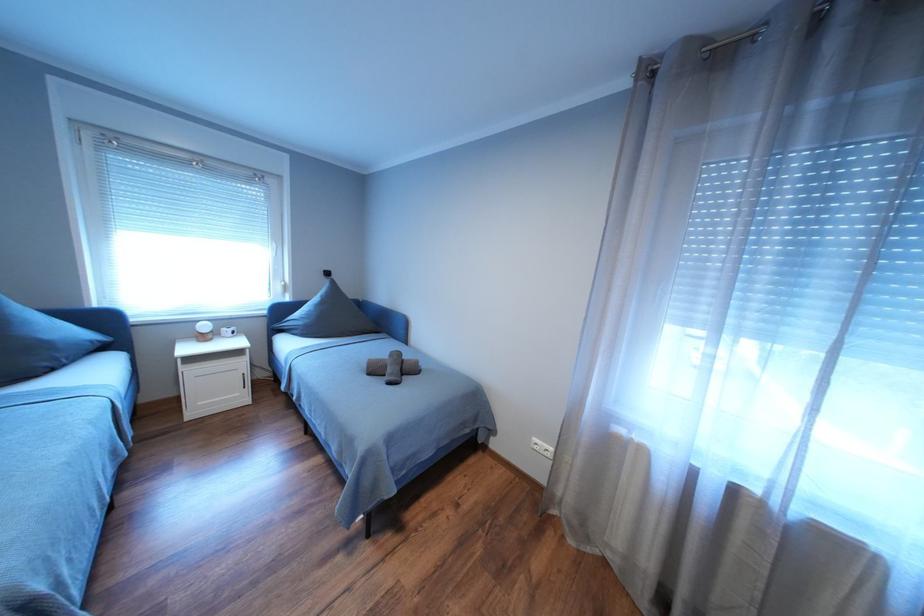
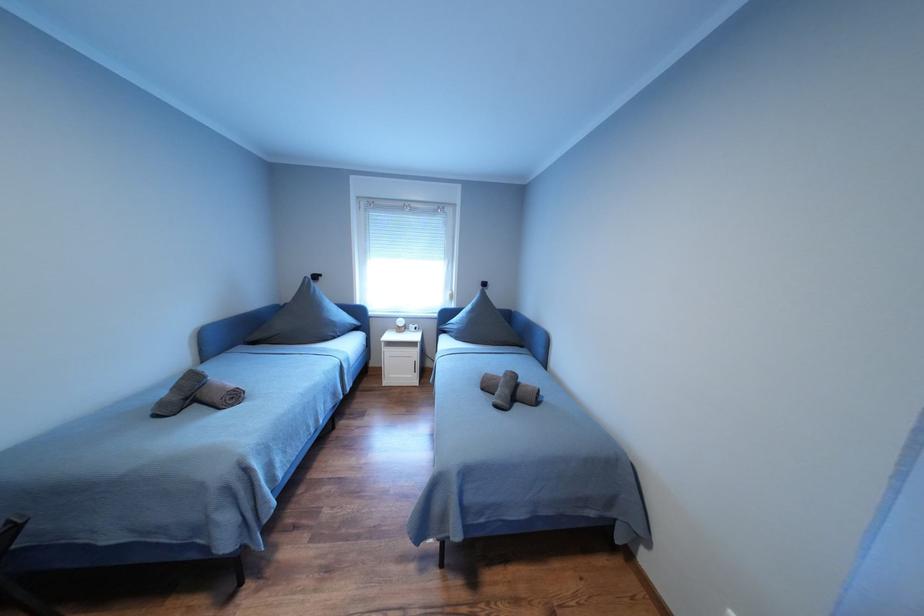
Question: The first image is from the beginning of the video and the second image is from the end. How did the camera likely rotate when shooting the video?

Choices:
 (A) Left
 (B) Right
 (C) Up
 (D) Down

Answer: (A)